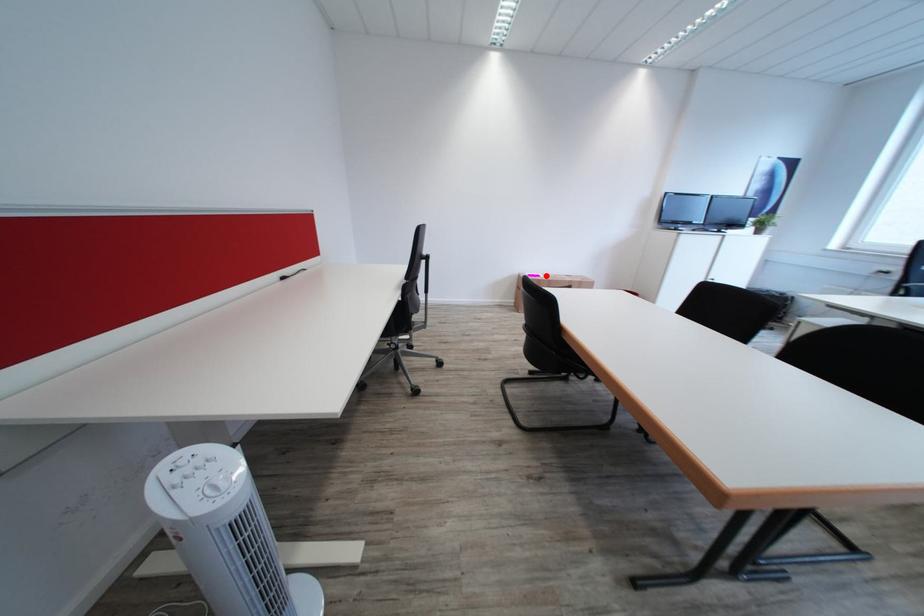
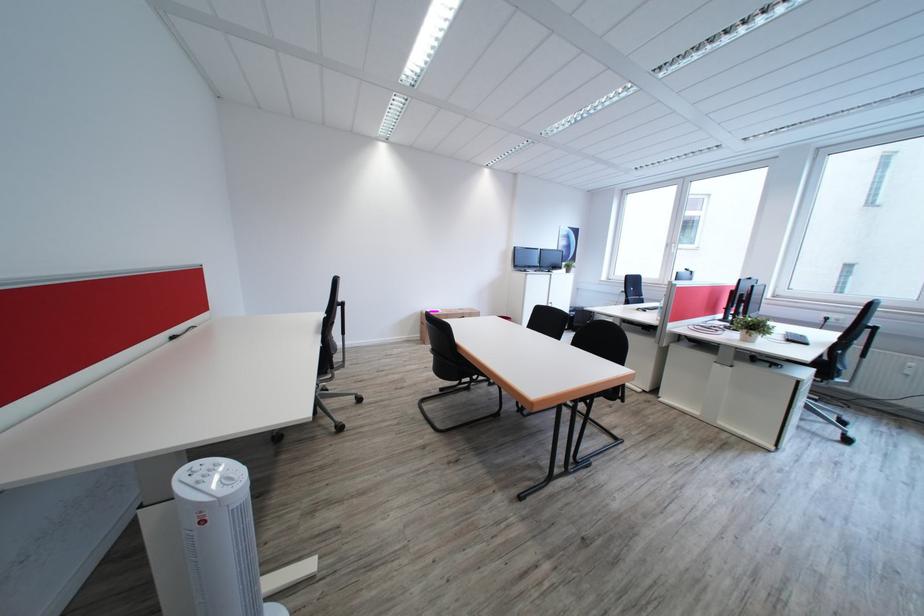
Question: I am providing you with two images of the same scene from different viewpoints. In image1, a red point is highlighted. Considering the same 3D point in image2, which of the following is correct?

Choices:
 (A) It is closer
 (B) It is farther

Answer: (A)